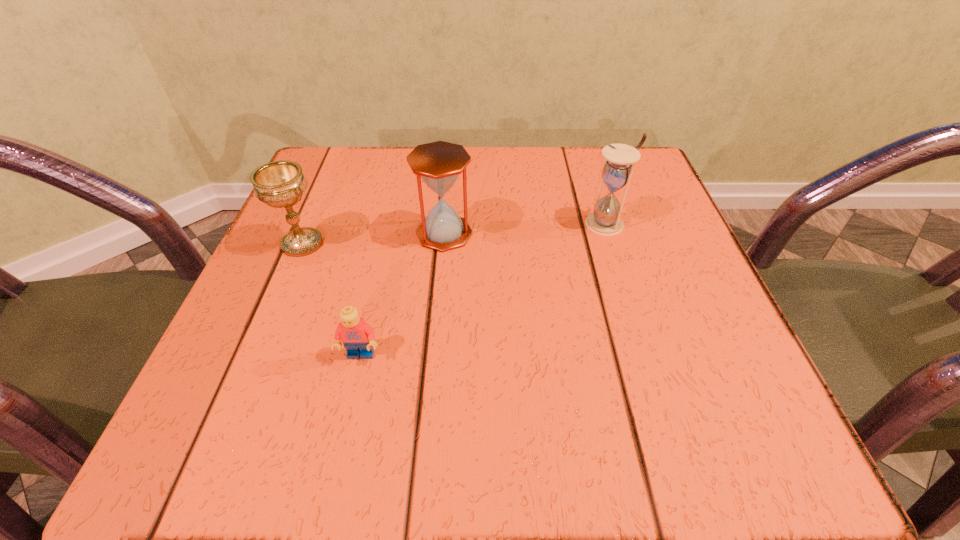
Locate an element on the screen. The height and width of the screenshot is (540, 960). free space between the third object from left to right and the leftmost object is located at coordinates (373, 239).

The width and height of the screenshot is (960, 540). I want to click on free spot between the chalice and the second object from left to right, so click(331, 299).

This screenshot has width=960, height=540. Identify the location of free space between the left hourglass and the rightmost object. point(525,228).

Find the location of a particular element. free space between the rightmost object and the nearest object is located at coordinates (484, 289).

Where is `free space that is in between the second object from left to right and the leftmost object`? free space that is in between the second object from left to right and the leftmost object is located at coordinates (331, 299).

Identify the location of free space between the shortest object and the second object from right to left. This screenshot has width=960, height=540. (402, 294).

This screenshot has width=960, height=540. I want to click on vacant point located between the rightmost object and the shortest object, so click(x=484, y=289).

In order to click on free space between the second object from left to right and the leftmost object in this screenshot , I will do `click(331, 299)`.

Where is `vacant point located between the second object from right to left and the chalice`? This screenshot has height=540, width=960. vacant point located between the second object from right to left and the chalice is located at coordinates (373, 239).

Image resolution: width=960 pixels, height=540 pixels. I want to click on unoccupied position between the left hourglass and the chalice, so click(x=373, y=239).